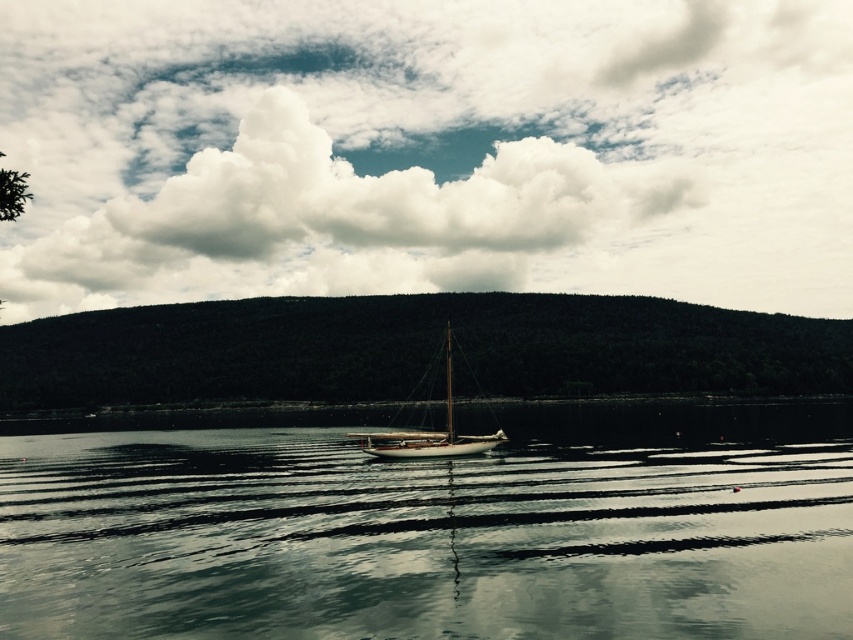
Question: Which object is the closest to the white fluffy cloud at upper center?

Choices:
 (A) smooth dark water at center
 (B) wooden sailboat at center

Answer: (B)

Question: Which object is closer to the camera taking this photo?

Choices:
 (A) white fluffy cloud at upper center
 (B) wooden sailboat at center

Answer: (B)

Question: Which object appears farthest from the camera in this image?

Choices:
 (A) white fluffy cloud at upper center
 (B) smooth dark water at center

Answer: (A)

Question: Is white fluffy cloud at upper center below wooden sailboat at center?

Choices:
 (A) no
 (B) yes

Answer: (A)

Question: Is white fluffy cloud at upper center above smooth dark water at center?

Choices:
 (A) no
 (B) yes

Answer: (B)

Question: Can you confirm if white fluffy cloud at upper center is bigger than wooden sailboat at center?

Choices:
 (A) yes
 (B) no

Answer: (A)